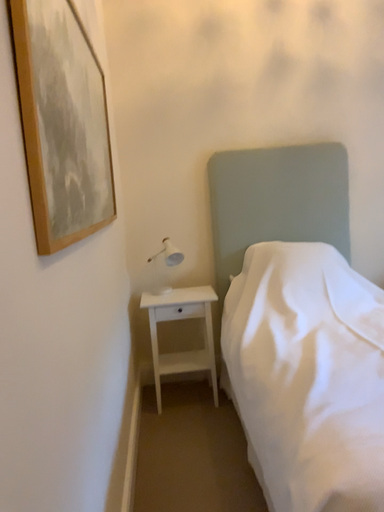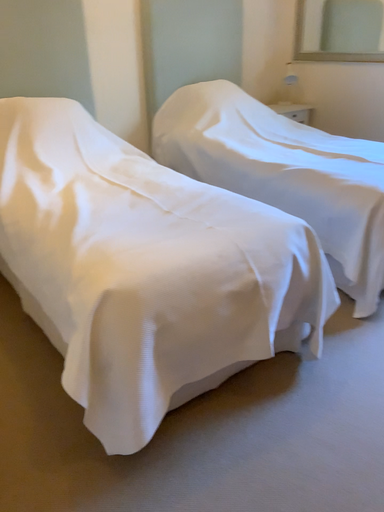
Question: Which way did the camera rotate in the video?

Choices:
 (A) rotated upward
 (B) rotated downward

Answer: (B)